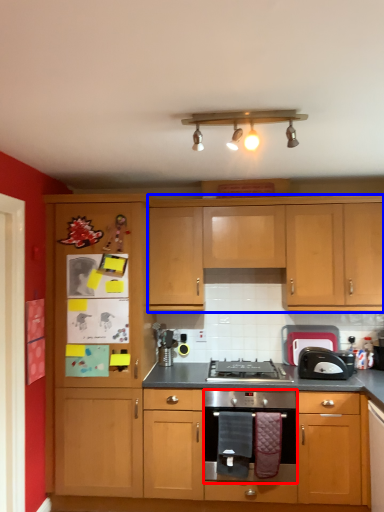
Question: Which object appears farthest to the camera in this image, kitchen appliance (highlighted by a red box) or cabinetry (highlighted by a blue box)?

Choices:
 (A) kitchen appliance
 (B) cabinetry

Answer: (B)